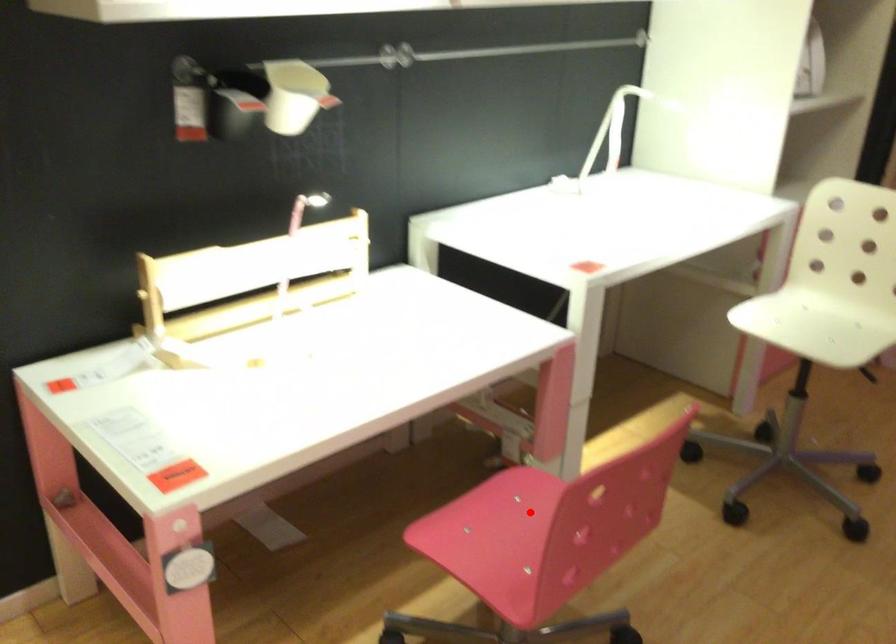
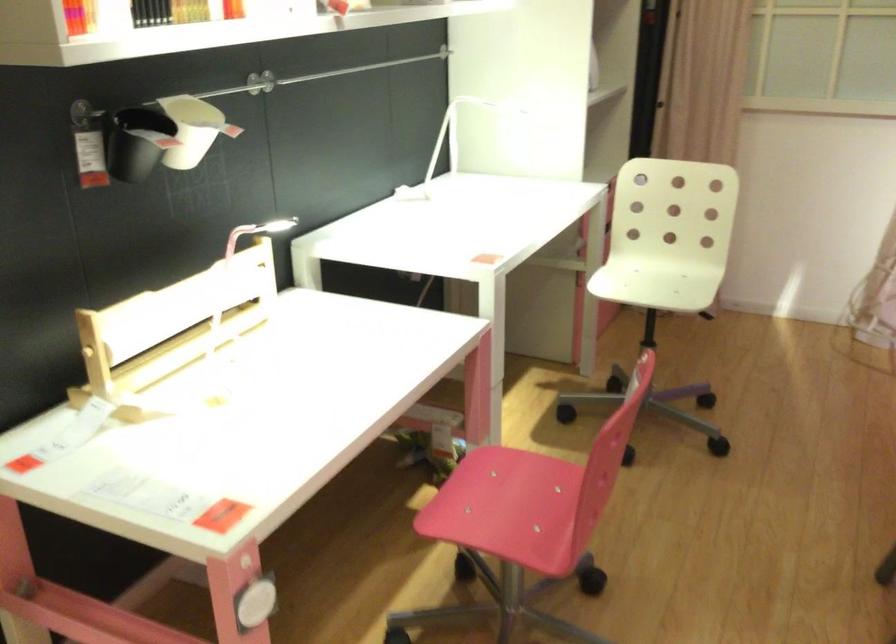
Find the pixel in the second image that matches the highlighted location in the first image.

(511, 482)